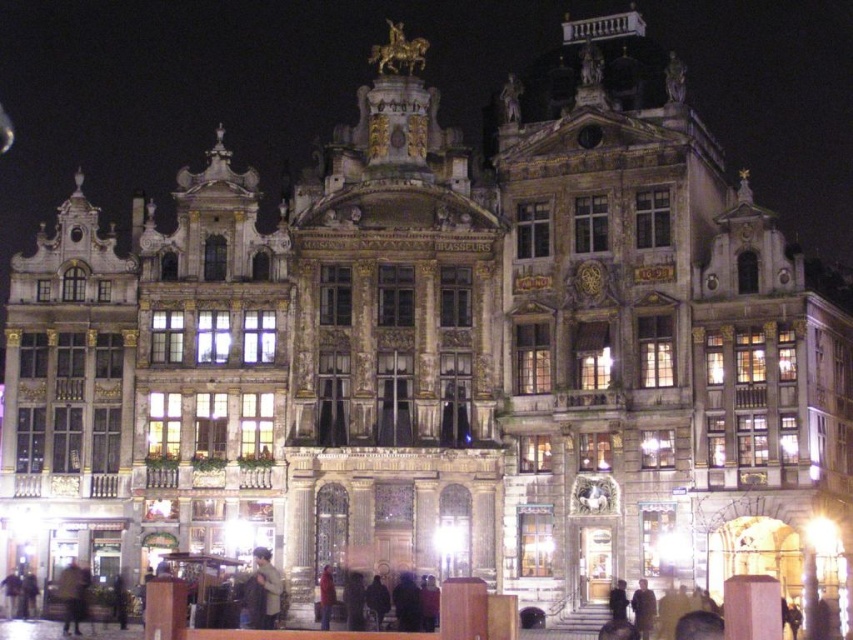
You are a delivery person standing at the entrance of the grand ornate building. You need to deliver a package to the dark brown leather jacket at lower center and then to the dark brown leather jacket at lower left. If your delivery cart can only travel 15 meters before needing a recharge, can you complete both deliveries without recharging?

The dark brown leather jacket at lower center and dark brown leather jacket at lower left are 13.89 meters apart from each other. Since the total distance between them is less than 15 meters, you can complete both deliveries without needing to recharge your cart.